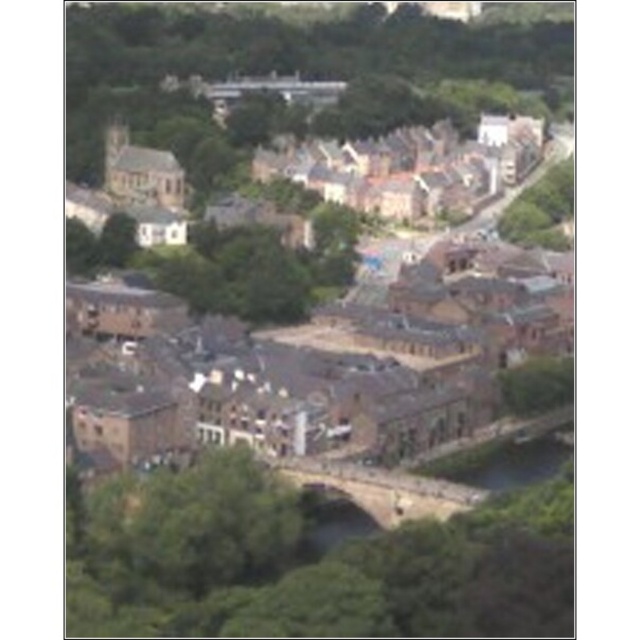
You are a tourist standing on the brown stone bridge at center and want to take a photo of the green grassy river at lower center. Since the bridge is elevated, will you need to look up or down to frame the river in your camera?

The brown stone bridge at center is much taller than the green grassy river at lower center, so you will need to look down to frame the river in your camera.

From the picture: You are a tourist standing at the edge of the town, looking towards the center. You notice the brown stone buildings at center and the stone bridge at center. Which one appears taller from your viewpoint?

The brown stone buildings at center appears taller than the stone bridge at center from your viewpoint.

You are a drone operator flying over the town and need to locate the brown stone buildings at center. According to the coordinates provided, where exactly are they situated in the image?

The brown stone buildings at center are located at the coordinates point (332, 310).